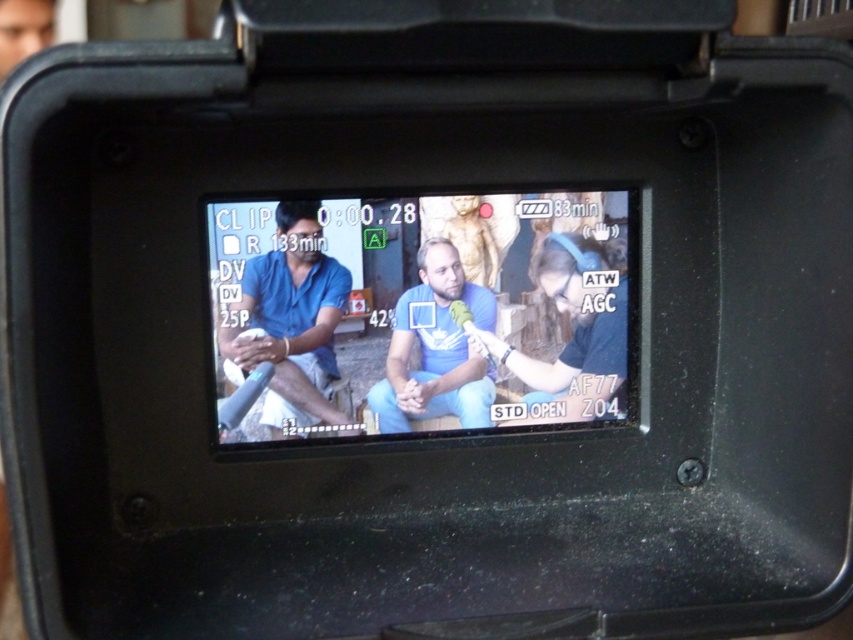
Identify the location of matte blue shirt at center. (285, 317).

Is the position of matte blue shirt at center more distant than that of blue denim jeans at center?

No, matte blue shirt at center is in front of blue denim jeans at center.

Identify the location of matte blue shirt at center. (285, 317).

Between blue denim jeans at center and blue matte shirt at center, which one appears on the right side from the viewer's perspective?

Positioned to the right is blue denim jeans at center.

You are a GUI agent. You are given a task and a screenshot of the screen. Output one action in this format:
    pyautogui.click(x=<x>, y=<y>)
    Task: Click on the blue denim jeans at center
    
    Given the screenshot: What is the action you would take?
    pyautogui.click(x=573, y=333)

Looking at this image, is blue fabric shirt at center above blue denim jeans at center?

Yes.

Where is `blue fabric shirt at center`? This screenshot has height=640, width=853. blue fabric shirt at center is located at coordinates (421, 310).

Locate an element on the screen. This screenshot has height=640, width=853. blue fabric shirt at center is located at coordinates (421, 310).